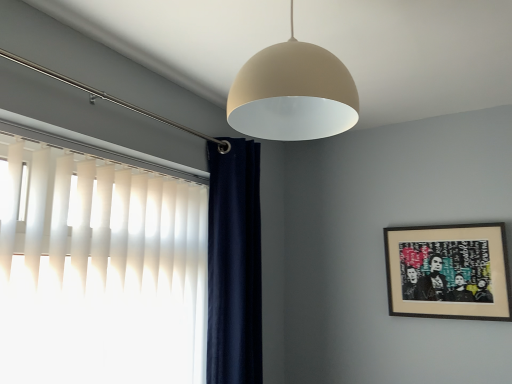
Question: Considering the positions of wooden framed artwork at right and white vertical blinds at left in the image, is wooden framed artwork at right taller or shorter than white vertical blinds at left?

Choices:
 (A) tall
 (B) short

Answer: (B)

Question: Considering the positions of point (417, 312) and point (83, 180), is point (417, 312) closer or farther from the camera than point (83, 180)?

Choices:
 (A) farther
 (B) closer

Answer: (A)

Question: Estimate the real-world distances between objects in this image. Which object is closer to the navy velvet curtain at left?

Choices:
 (A) white vertical blinds at left
 (B) wooden framed artwork at right
 (C) matte beige dome at upper center

Answer: (A)

Question: Based on their relative distances, which object is nearer to the matte beige dome at upper center?

Choices:
 (A) navy velvet curtain at left
 (B) wooden framed artwork at right
 (C) white vertical blinds at left

Answer: (C)